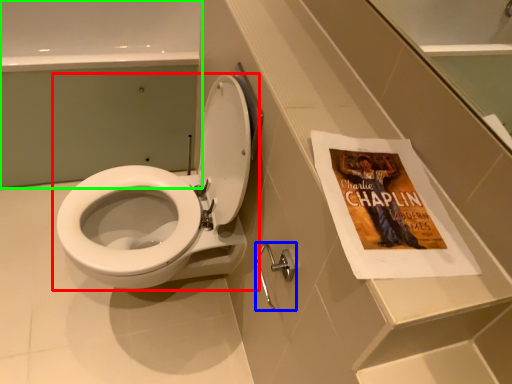
Question: Which object is the farthest from toilet (highlighted by a red box)? Choose among these: towel bar (highlighted by a blue box) or bath (highlighted by a green box).

Choices:
 (A) towel bar
 (B) bath

Answer: (B)